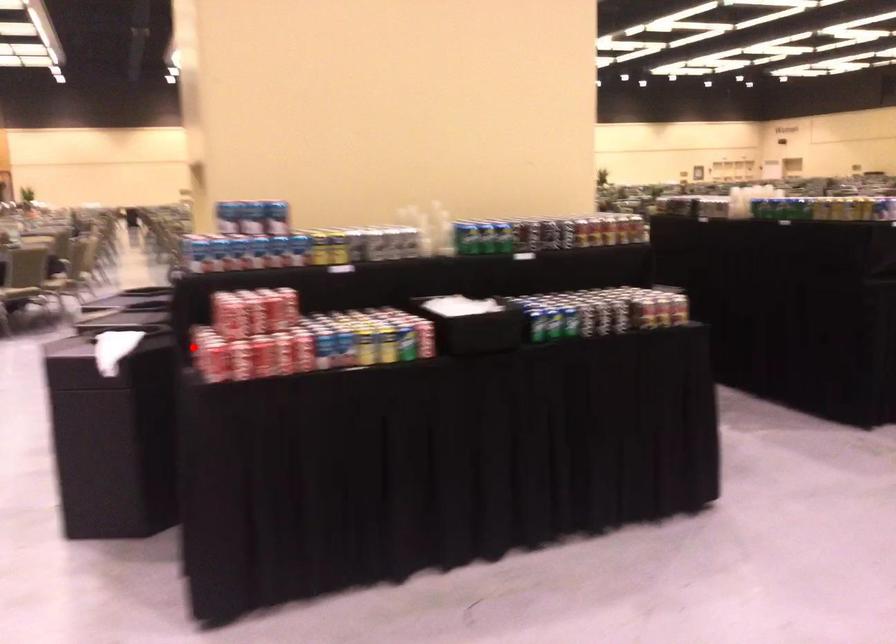
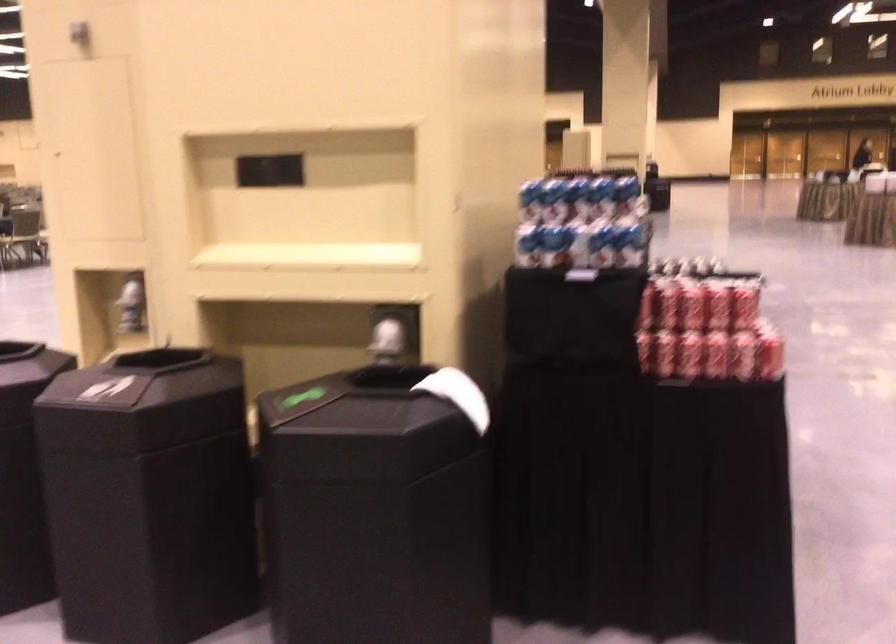
Locate, in the second image, the point that corresponds to the highlighted location in the first image.

(688, 355)